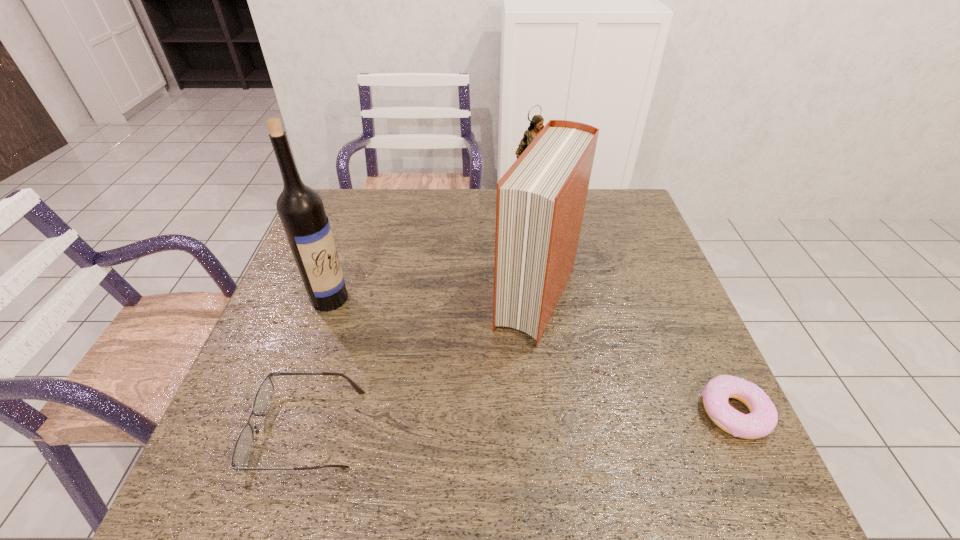
This screenshot has width=960, height=540. I want to click on spectacles, so click(244, 441).

Identify the location of doughnut. This screenshot has height=540, width=960. (763, 417).

The image size is (960, 540). I want to click on wine bottle, so click(x=300, y=208).

Where is `the fourth shortest object`? the fourth shortest object is located at coordinates (540, 203).

Find the location of a particular element. The image size is (960, 540). the third shortest object is located at coordinates (536, 125).

The image size is (960, 540). Find the location of `the farthest object`. the farthest object is located at coordinates (536, 125).

Locate an element on the screen. blank area located on the front-facing side of the spectacles is located at coordinates (220, 429).

The height and width of the screenshot is (540, 960). Find the location of `vacant space positioned 0.110m on the back of the rightmost object`. vacant space positioned 0.110m on the back of the rightmost object is located at coordinates (702, 344).

Identify the location of vacant area situated 0.260m on the label of the wine bottle. (418, 355).

Find the location of `vacant space located on the label of the wine bottle`. vacant space located on the label of the wine bottle is located at coordinates (463, 384).